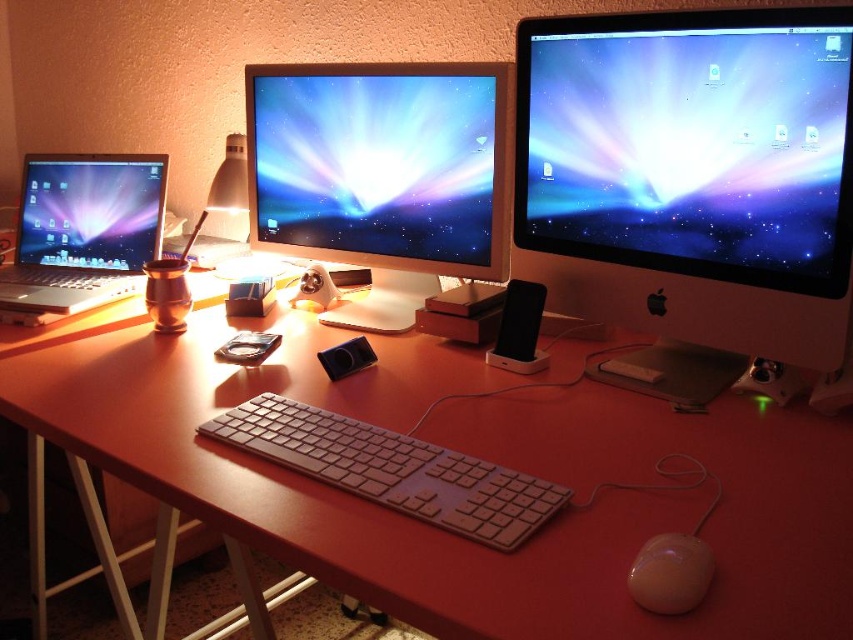
Describe the element at coordinates (379, 163) in the screenshot. I see `glossy plastic monitor at center` at that location.

Between point (314, 80) and point (376, 456), which one is positioned in front?

Positioned in front is point (376, 456).

The width and height of the screenshot is (853, 640). I want to click on glossy plastic monitor at center, so click(x=379, y=163).

Who is more forward, (x=210, y=406) or (x=675, y=541)?

Point (x=675, y=541) is more forward.

Which is behind, point (117, 608) or point (686, 605)?

Point (117, 608)

Identify the location of matte wood table at center. (473, 454).

Who is positioned more to the left, satin silver monitor at upper right or glossy plastic monitor at center?

glossy plastic monitor at center is more to the left.

Who is positioned more to the right, satin silver monitor at upper right or glossy plastic monitor at center?

satin silver monitor at upper right

Is point (567, 188) farther from camera compared to point (476, 83)?

No, (567, 188) is closer to viewer.

What are the coordinates of `satin silver monitor at upper right` in the screenshot? It's located at (691, 173).